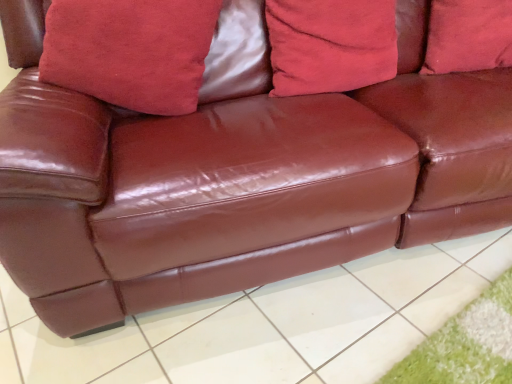
In order to face shiny brown leather couch at center, should I rotate leftwards or rightwards?

You should look right and rotate roughly 3.321 degrees.

This screenshot has width=512, height=384. I want to click on suede-like red pillow at upper center, the 1th pillow from the left, so click(130, 51).

Where is `shiny brown leather couch at center`? This screenshot has width=512, height=384. shiny brown leather couch at center is located at coordinates (268, 324).

Looking at the image, does suede-like red pillow at upper center, arranged as the third pillow when viewed from the right, seem bigger or smaller compared to shiny brown leather couch at center?

Clearly, suede-like red pillow at upper center, arranged as the third pillow when viewed from the right, is smaller in size than shiny brown leather couch at center.

Can you confirm if suede-like red pillow at upper center, the 1th pillow from the left, is taller than shiny brown leather couch at center?

Yes, suede-like red pillow at upper center, the 1th pillow from the left, is taller than shiny brown leather couch at center.

The width and height of the screenshot is (512, 384). Find the location of `the 3rd pillow directly above the shiny brown leather couch at center (from a real-world perspective)`. the 3rd pillow directly above the shiny brown leather couch at center (from a real-world perspective) is located at coordinates (130, 51).

In the scene shown: From the image's perspective, is suede-like red pillow at upper center, the 1th pillow from the left, located above shiny brown leather couch at center?

Yes.

From the image's perspective, is suede-like red pillow at upper center, the 1th pillow from the left, over suede-like red pillow at upper center, which appears as the 1th pillow when viewed from the right?

No, from the image's perspective, suede-like red pillow at upper center, the 1th pillow from the left, is not above suede-like red pillow at upper center, which appears as the 1th pillow when viewed from the right.

Is suede-like red pillow at upper center, arranged as the third pillow when viewed from the right, thinner than suede-like red pillow at upper center, which appears as the 1th pillow when viewed from the right?

In fact, suede-like red pillow at upper center, arranged as the third pillow when viewed from the right, might be wider than suede-like red pillow at upper center, which appears as the 1th pillow when viewed from the right.

Is suede-like red pillow at upper center, arranged as the third pillow when viewed from the right, oriented towards suede-like red pillow at upper center, which ranks as the third pillow in left-to-right order?

No, suede-like red pillow at upper center, arranged as the third pillow when viewed from the right, is not facing towards suede-like red pillow at upper center, which ranks as the third pillow in left-to-right order.

Is velvet red pillow at center, acting as the second pillow starting from the left, not near suede-like red pillow at upper center, which appears as the 1th pillow when viewed from the right?

That's not correct — velvet red pillow at center, acting as the second pillow starting from the left, is a little close to suede-like red pillow at upper center, which appears as the 1th pillow when viewed from the right.

From the image's perspective, is velvet red pillow at center, which ranks as the second pillow in right-to-left order, located above suede-like red pillow at upper center, which appears as the 1th pillow when viewed from the right?

Actually, velvet red pillow at center, which ranks as the second pillow in right-to-left order, appears below suede-like red pillow at upper center, which appears as the 1th pillow when viewed from the right, in the image.

What's the angular difference between velvet red pillow at center, which ranks as the second pillow in right-to-left order, and suede-like red pillow at upper center, which ranks as the third pillow in left-to-right order,'s facing directions?

velvet red pillow at center, which ranks as the second pillow in right-to-left order, and suede-like red pillow at upper center, which ranks as the third pillow in left-to-right order, are facing 1.98 degrees away from each other.

Is suede-like red pillow at upper center, which appears as the 1th pillow when viewed from the right, a part of velvet red pillow at center, which ranks as the second pillow in right-to-left order?

No, suede-like red pillow at upper center, which appears as the 1th pillow when viewed from the right, is located outside of velvet red pillow at center, which ranks as the second pillow in right-to-left order.

Is point (496, 43) closer or farther from the camera than point (358, 33)?

Point (496, 43) is farther from the camera than point (358, 33).

Considering the relative positions of suede-like red pillow at upper center, which ranks as the third pillow in left-to-right order, and velvet red pillow at center, which ranks as the second pillow in right-to-left order, in the image provided, is suede-like red pillow at upper center, which ranks as the third pillow in left-to-right order, to the left of velvet red pillow at center, which ranks as the second pillow in right-to-left order, from the viewer's perspective?

In fact, suede-like red pillow at upper center, which ranks as the third pillow in left-to-right order, is to the right of velvet red pillow at center, which ranks as the second pillow in right-to-left order.

Is suede-like red pillow at upper center, which ranks as the third pillow in left-to-right order, wider than velvet red pillow at center, which ranks as the second pillow in right-to-left order?

Yes.

Is suede-like red pillow at upper center, which appears as the 1th pillow when viewed from the right, in front of or behind velvet red pillow at center, which ranks as the second pillow in right-to-left order, in the image?

suede-like red pillow at upper center, which appears as the 1th pillow when viewed from the right, is behind velvet red pillow at center, which ranks as the second pillow in right-to-left order.

Is point (322, 83) less distant than point (46, 344)?

No, (322, 83) is further to viewer.

Between velvet red pillow at center, which ranks as the second pillow in right-to-left order, and shiny brown leather couch at center, which one appears on the left side from the viewer's perspective?

shiny brown leather couch at center.

Is velvet red pillow at center, which ranks as the second pillow in right-to-left order, located outside shiny brown leather couch at center?

Indeed, velvet red pillow at center, which ranks as the second pillow in right-to-left order, is completely outside shiny brown leather couch at center.

In the scene shown: Who is shorter, velvet red pillow at center, which ranks as the second pillow in right-to-left order, or shiny brown leather couch at center?

With less height is shiny brown leather couch at center.

Considering the sizes of suede-like red pillow at upper center, which ranks as the third pillow in left-to-right order, and shiny brown leather couch at center in the image, is suede-like red pillow at upper center, which ranks as the third pillow in left-to-right order, bigger or smaller than shiny brown leather couch at center?

Considering their sizes, suede-like red pillow at upper center, which ranks as the third pillow in left-to-right order, takes up less space than shiny brown leather couch at center.

Does suede-like red pillow at upper center, which appears as the 1th pillow when viewed from the right, turn towards shiny brown leather couch at center?

No, suede-like red pillow at upper center, which appears as the 1th pillow when viewed from the right, does not turn towards shiny brown leather couch at center.

Considering the points (457, 66) and (173, 330), which point is in front, point (457, 66) or point (173, 330)?

The point (173, 330) is closer to the camera.

Are suede-like red pillow at upper center, which ranks as the third pillow in left-to-right order, and shiny brown leather couch at center beside each other?

No, suede-like red pillow at upper center, which ranks as the third pillow in left-to-right order, is not beside shiny brown leather couch at center.

From their relative heights in the image, would you say velvet red pillow at center, which ranks as the second pillow in right-to-left order, is taller or shorter than suede-like red pillow at upper center, the 1th pillow from the left?

Considering their sizes, velvet red pillow at center, which ranks as the second pillow in right-to-left order, has less height than suede-like red pillow at upper center, the 1th pillow from the left.

Which is correct: velvet red pillow at center, acting as the second pillow starting from the left, is inside suede-like red pillow at upper center, the 1th pillow from the left, or outside of it?

velvet red pillow at center, acting as the second pillow starting from the left, is spatially situated outside suede-like red pillow at upper center, the 1th pillow from the left.

What's the angular difference between velvet red pillow at center, which ranks as the second pillow in right-to-left order, and suede-like red pillow at upper center, the 1th pillow from the left,'s facing directions?

4.2 degrees.

Considering the relative sizes of velvet red pillow at center, which ranks as the second pillow in right-to-left order, and suede-like red pillow at upper center, the 1th pillow from the left, in the image provided, is velvet red pillow at center, which ranks as the second pillow in right-to-left order, bigger than suede-like red pillow at upper center, the 1th pillow from the left,?

Incorrect, velvet red pillow at center, which ranks as the second pillow in right-to-left order, is not larger than suede-like red pillow at upper center, the 1th pillow from the left.

Find the location of `tile on the right of suede-like red pillow at upper center, the 1th pillow from the left`. tile on the right of suede-like red pillow at upper center, the 1th pillow from the left is located at coordinates (268, 324).

There is a suede-like red pillow at upper center, which ranks as the third pillow in left-to-right order. Where is `the 2nd pillow below it (from the image's perspective)`? The width and height of the screenshot is (512, 384). the 2nd pillow below it (from the image's perspective) is located at coordinates (130, 51).

Looking at the image, which one is located further to shiny brown leather couch at center, suede-like red pillow at upper center, the 1th pillow from the left, or suede-like red pillow at upper center, which ranks as the third pillow in left-to-right order?

suede-like red pillow at upper center, which ranks as the third pillow in left-to-right order.

When comparing their distances from suede-like red pillow at upper center, arranged as the third pillow when viewed from the right, does suede-like red pillow at upper center, which ranks as the third pillow in left-to-right order, or shiny brown leather couch at center seem closer?

Based on the image, shiny brown leather couch at center appears to be nearer to suede-like red pillow at upper center, arranged as the third pillow when viewed from the right.

Consider the image. Looking at the image, which one is located closer to suede-like red pillow at upper center, arranged as the third pillow when viewed from the right, suede-like red pillow at upper center, which ranks as the third pillow in left-to-right order, or velvet red pillow at center, acting as the second pillow starting from the left?

velvet red pillow at center, acting as the second pillow starting from the left, is positioned closer to the anchor suede-like red pillow at upper center, arranged as the third pillow when viewed from the right.

Looking at the image, which one is located closer to velvet red pillow at center, acting as the second pillow starting from the left, suede-like red pillow at upper center, arranged as the third pillow when viewed from the right, or suede-like red pillow at upper center, which ranks as the third pillow in left-to-right order?

Among the two, suede-like red pillow at upper center, which ranks as the third pillow in left-to-right order, is located nearer to velvet red pillow at center, acting as the second pillow starting from the left.

Which object lies further to the anchor point velvet red pillow at center, which ranks as the second pillow in right-to-left order, suede-like red pillow at upper center, which ranks as the third pillow in left-to-right order, or suede-like red pillow at upper center, the 1th pillow from the left?

suede-like red pillow at upper center, the 1th pillow from the left, lies further to velvet red pillow at center, which ranks as the second pillow in right-to-left order, than the other object.

Looking at the image, which one is located closer to suede-like red pillow at upper center, which ranks as the third pillow in left-to-right order, suede-like red pillow at upper center, the 1th pillow from the left, or shiny brown leather couch at center?

The object closer to suede-like red pillow at upper center, which ranks as the third pillow in left-to-right order, is shiny brown leather couch at center.

Which object lies further to the anchor point shiny brown leather couch at center, velvet red pillow at center, acting as the second pillow starting from the left, or suede-like red pillow at upper center, arranged as the third pillow when viewed from the right?

suede-like red pillow at upper center, arranged as the third pillow when viewed from the right.

Which object lies nearer to the anchor point suede-like red pillow at upper center, which ranks as the third pillow in left-to-right order, shiny brown leather couch at center or suede-like red pillow at upper center, arranged as the third pillow when viewed from the right?

shiny brown leather couch at center is positioned closer to the anchor suede-like red pillow at upper center, which ranks as the third pillow in left-to-right order.

The height and width of the screenshot is (384, 512). Identify the location of pillow located between suede-like red pillow at upper center, the 1th pillow from the left, and suede-like red pillow at upper center, which ranks as the third pillow in left-to-right order, in the left-right direction. (330, 44).

Locate an element on the screen. Image resolution: width=512 pixels, height=384 pixels. pillow between velvet red pillow at center, acting as the second pillow starting from the left, and shiny brown leather couch at center in the up-down direction is located at coordinates (130, 51).

What are the coordinates of `tile between suede-like red pillow at upper center, arranged as the third pillow when viewed from the right, and suede-like red pillow at upper center, which appears as the 1th pillow when viewed from the right, from left to right` in the screenshot? It's located at pos(268,324).